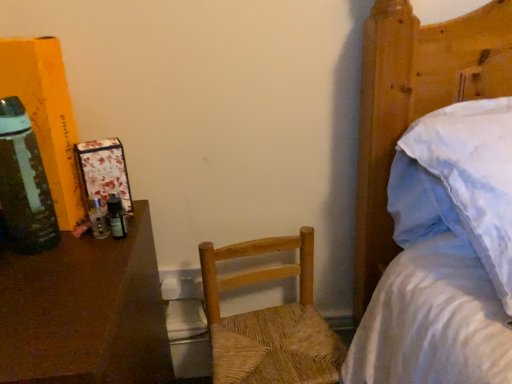
Question: In terms of size, does woven wood chair at center appear bigger or smaller than white cotton bed at upper right?

Choices:
 (A) big
 (B) small

Answer: (B)

Question: Is point (257, 367) closer or farther from the camera than point (425, 44)?

Choices:
 (A) closer
 (B) farther

Answer: (B)

Question: Which object is the closest to the brown polished wood desk at left?

Choices:
 (A) white cotton bed at upper right
 (B) woven wood chair at center
 (C) green glass bottle at left

Answer: (C)

Question: Estimate the real-world distances between objects in this image. Which object is closer to the green glass bottle at left?

Choices:
 (A) woven wood chair at center
 (B) white cotton bed at upper right
 (C) brown polished wood desk at left

Answer: (C)